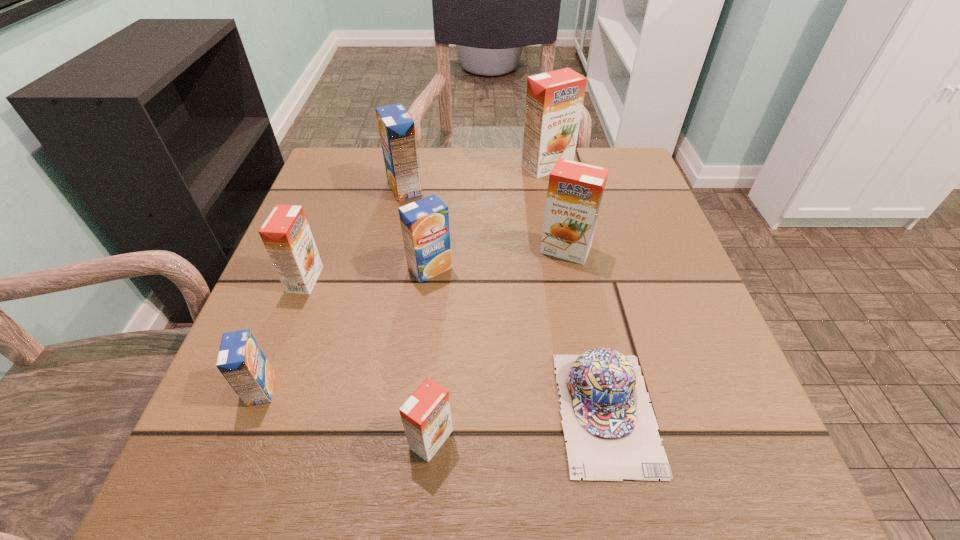
Identify the location of free space between the third biggest orange orange juice and the shortest object. (456, 346).

This screenshot has height=540, width=960. I want to click on vacant area that lies between the second biggest blue orange_juice and the cap, so click(x=518, y=340).

Locate an element on the screen. This screenshot has height=540, width=960. unoccupied area between the second biggest orange orange juice and the second biggest blue orange_juice is located at coordinates (497, 259).

Locate an element on the screen. free point between the second smallest blue orange_juice and the nearest orange_juice is located at coordinates (431, 354).

The width and height of the screenshot is (960, 540). In order to click on vacant space that is in between the smallest orange orange juice and the farthest orange orange juice in this screenshot , I will do `click(489, 303)`.

This screenshot has width=960, height=540. What are the coordinates of `free space between the second farthest orange orange juice and the farthest blue orange_juice` in the screenshot? It's located at (485, 219).

This screenshot has width=960, height=540. In order to click on free point between the biggest orange orange juice and the nearest blue orange_juice in this screenshot , I will do `click(404, 278)`.

Find the location of `empty space between the biggest orange orange juice and the cap`. empty space between the biggest orange orange juice and the cap is located at coordinates (577, 289).

Identify the location of vacant area between the second farthest orange orange juice and the farthest blue orange_juice. Image resolution: width=960 pixels, height=540 pixels. (485, 219).

In order to click on the seventh closest object relative to the second farthest blue orange_juice in this screenshot , I will do `click(554, 100)`.